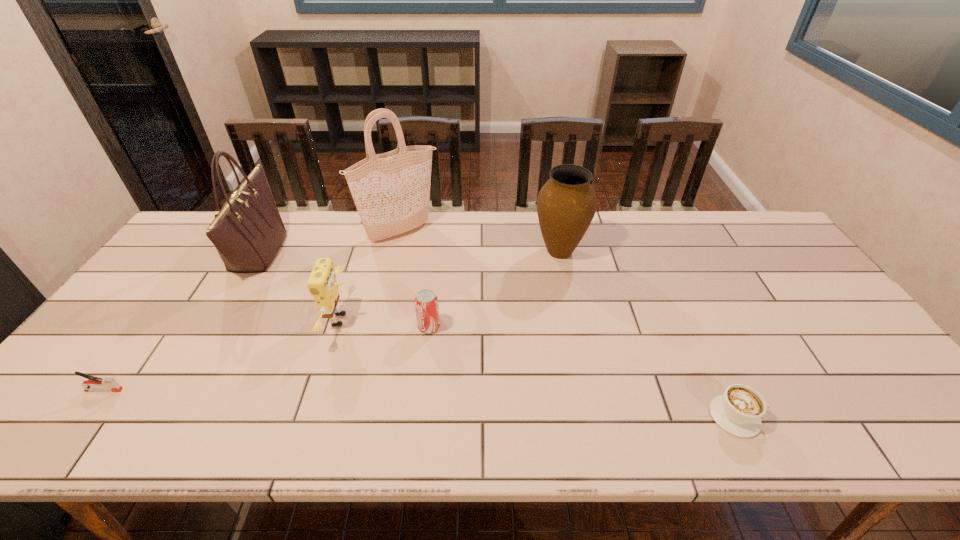
This screenshot has width=960, height=540. What are the coordinates of `shopping bag` in the screenshot? It's located at (391, 191).

Locate an element on the screen. The width and height of the screenshot is (960, 540). the second tallest object is located at coordinates (248, 231).

The height and width of the screenshot is (540, 960). I want to click on handbag, so click(248, 231).

The width and height of the screenshot is (960, 540). What are the coordinates of `urn` in the screenshot? It's located at (566, 204).

Identify the location of the second object from right to left. (x=566, y=204).

Identify the location of the fourth shortest object. The image size is (960, 540). (322, 284).

What are the coordinates of `soda can` in the screenshot? It's located at (426, 301).

You are a GUI agent. You are given a task and a screenshot of the screen. Output one action in this format:
    pyautogui.click(x=<x>, y=<y>)
    Task: Click on the leftmost object
    The width and height of the screenshot is (960, 540).
    Given the screenshot: What is the action you would take?
    pyautogui.click(x=110, y=384)

At what (x,y) coordinates should I click in order to perform the action: click on the sixth farthest object. Please return your answer as a coordinate pair (x, y). This screenshot has height=540, width=960. Looking at the image, I should click on (110, 384).

The width and height of the screenshot is (960, 540). Find the location of `the nearest object`. the nearest object is located at coordinates (739, 411).